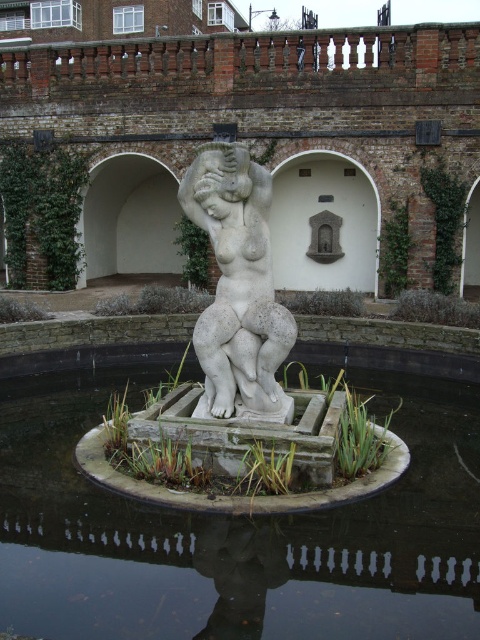
Between point (128, 524) and point (218, 362), which one is positioned behind?

Point (218, 362)

Is point (422, 460) farther from camera compared to point (235, 164)?

Yes, point (422, 460) is farther from viewer.

Locate an element on the screen. The width and height of the screenshot is (480, 640). white stone water at center is located at coordinates (237, 531).